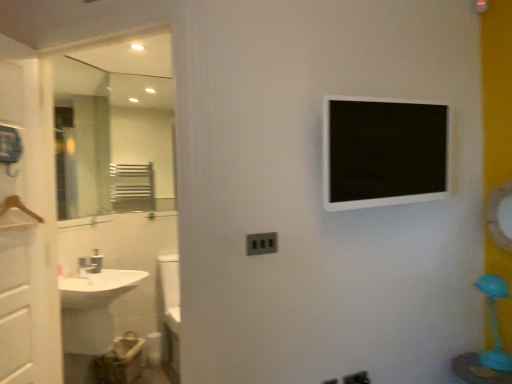
Question: Is white glossy screen door at left wider or thinner than matte gray electric outlet at center?

Choices:
 (A) wide
 (B) thin

Answer: (A)

Question: Visually, is white glossy screen door at left positioned to the left or to the right of matte gray electric outlet at center?

Choices:
 (A) left
 (B) right

Answer: (A)

Question: Which object is positioned closest to the white glossy sink at lower left?

Choices:
 (A) glossy metallic mirror at upper right
 (B) matte gray electric outlet at center
 (C) white glossy medicine cabinet at upper center
 (D) white glossy screen door at left

Answer: (D)

Question: Which object is positioned farthest from the glossy metallic mirror at upper right?

Choices:
 (A) white glossy sink at lower left
 (B) white glossy screen door at left
 (C) white glossy medicine cabinet at upper center
 (D) matte gray electric outlet at center

Answer: (B)